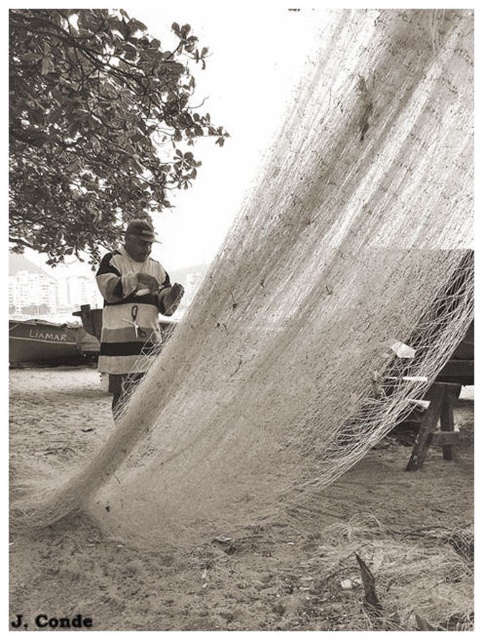
Based on the scene described, can you determine the spatial relationship between the striped fabric fisherman at center and the brushed metal boat at left?

The striped fabric fisherman at center is positioned to the right of the brushed metal boat at left.

You are a photographer trying to capture a clear image of the striped fabric fisherman at center and the brushed metal boat at left. Which object should you focus on first if you want to ensure both are in focus?

The striped fabric fisherman at center is in front of the brushed metal boat at left, so you should focus on the striped fabric fisherman at center first to ensure both are in focus.